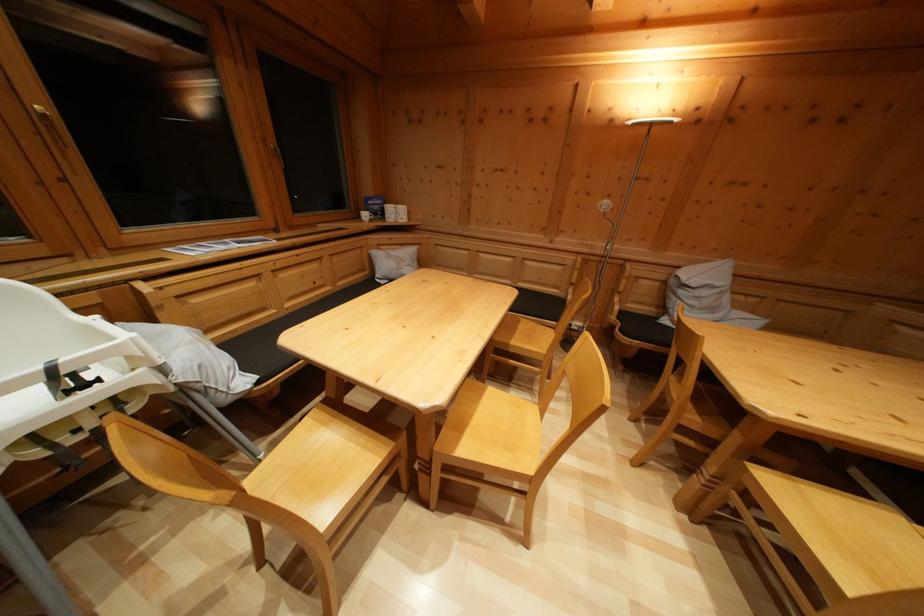
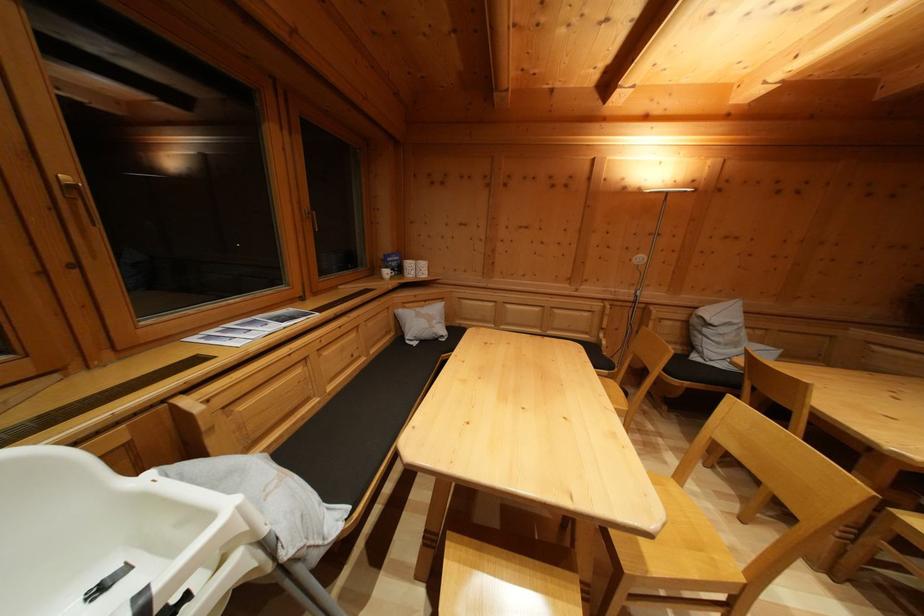
Locate, in the second image, the point that corresponds to point 407,252 in the first image.

(431, 308)